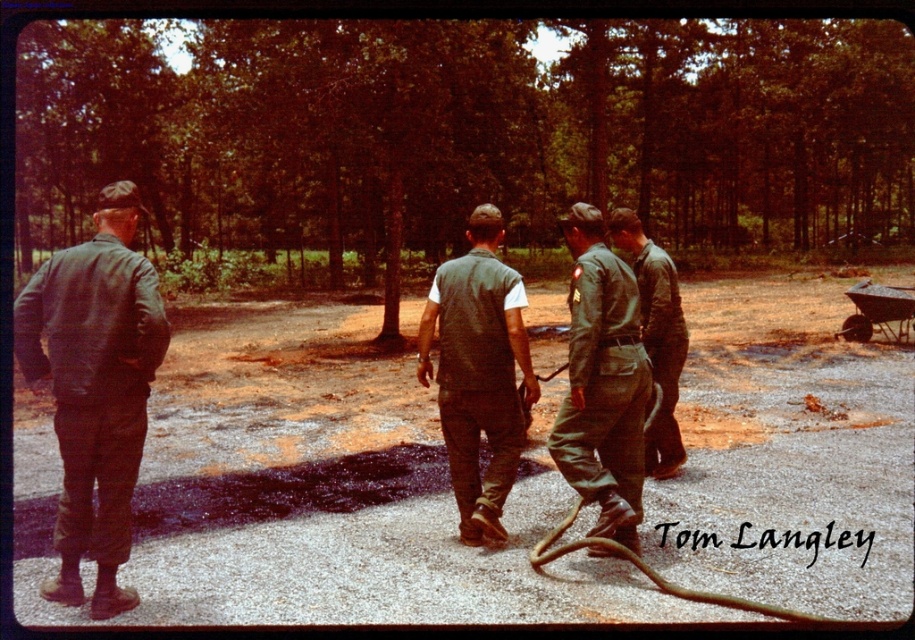
You are a new member of the team and need to identify the person closest to you. You see the green fabric vest at center and the green matte uniform at center. Which one is closer to you?

The green fabric vest at center is closer to you because it is in front of the green matte uniform at center.

You are a safety inspector in this wooded area. You notice two workers wearing the matte green jacket at left and the green uniform at center. According to safety protocols, the jacket must be visible over the uniform to ensure visibility. Is the current arrangement compliant with the safety rules?

The matte green jacket at left is positioned over the green uniform at center, so the current arrangement is compliant with the safety rules as the jacket is visible over the uniform.

You are a safety inspector assessing the scene. You notice two workers in the area. One is wearing a matte green jacket at left and the other is in a green uniform at center. Based on their height, which worker might be standing closer to you?

The matte green jacket at left is taller than the green uniform at center, so the worker in the matte green jacket at left is likely closer to you since objects closer appear larger.